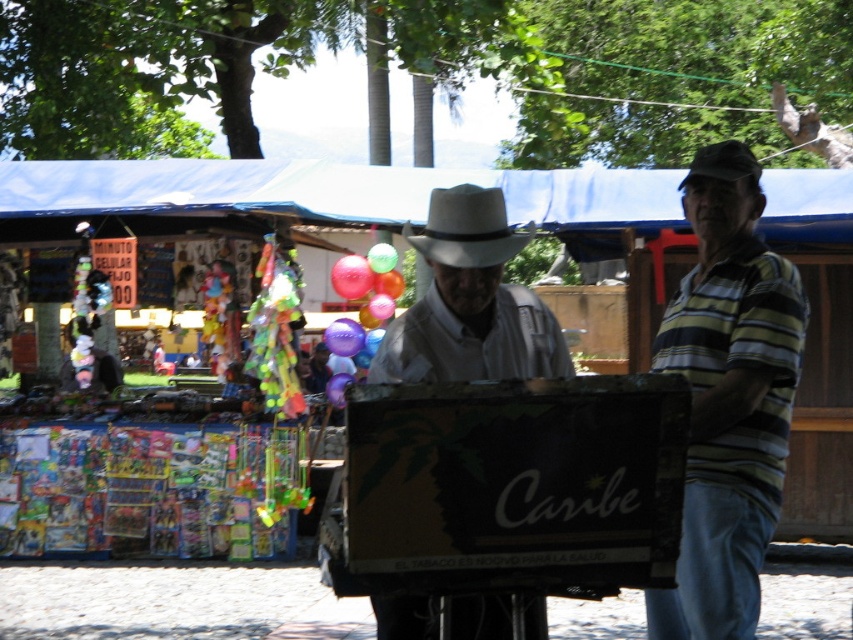
You are a tailor measuring the distance between two items in the image. The items are the striped cotton shirt at center and the gray felt fedora at center. The tailor needs to know if the distance between them is more than 30 inches to decide if they can be placed together on a display rack. Is the distance sufficient?

The striped cotton shirt at center is 32.02 inches from the gray felt fedora at center, which is more than 30 inches. Therefore, the distance is sufficient for placing them together on a display rack.

You are a customer at the market and see two hats displayed at the center of the stall. The gray felt fedora at center and the black felt fedora at center. Which one is bigger?

The gray felt fedora at center is larger in size than the black felt fedora at center.